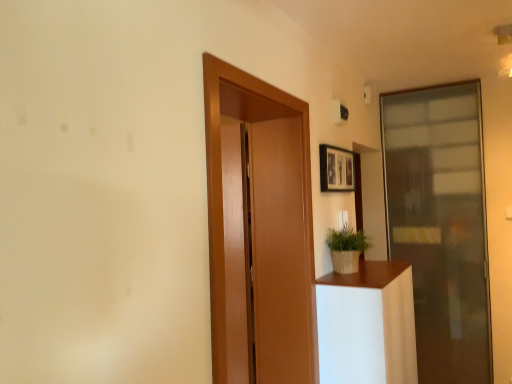
Question: From the image's perspective, does green woven basket at right appear higher than white matte plant pot at right?

Choices:
 (A) no
 (B) yes

Answer: (B)

Question: Is green woven basket at right thinner than white matte plant pot at right?

Choices:
 (A) no
 (B) yes

Answer: (B)

Question: Does green woven basket at right appear on the right side of white matte plant pot at right?

Choices:
 (A) no
 (B) yes

Answer: (A)

Question: Is white matte plant pot at right inside green woven basket at right?

Choices:
 (A) yes
 (B) no

Answer: (B)

Question: Is green woven basket at right to the left of white matte plant pot at right from the viewer's perspective?

Choices:
 (A) no
 (B) yes

Answer: (B)

Question: From their relative heights in the image, would you say transparent glass door at right, which is the first door from back to front, is taller or shorter than white matte plant pot at right?

Choices:
 (A) short
 (B) tall

Answer: (B)

Question: Is point (455, 226) positioned closer to the camera than point (398, 307)?

Choices:
 (A) farther
 (B) closer

Answer: (A)

Question: From the image's perspective, is transparent glass door at right, marked as the 1th door in a right-to-left arrangement, located above or below white matte plant pot at right?

Choices:
 (A) below
 (B) above

Answer: (B)

Question: Would you say transparent glass door at right, the 2th door positioned from the left, is to the left or to the right of white matte plant pot at right in the picture?

Choices:
 (A) right
 (B) left

Answer: (A)

Question: From the image's perspective, relative to transparent glass door at right, the 2th door positioned from the left, is green woven basket at right above or below?

Choices:
 (A) above
 (B) below

Answer: (A)

Question: Looking at their shapes, would you say green woven basket at right is wider or thinner than transparent glass door at right, marked as the 1th door in a right-to-left arrangement?

Choices:
 (A) wide
 (B) thin

Answer: (A)

Question: Do you think green woven basket at right is within transparent glass door at right, which is the second door from front to back, or outside of it?

Choices:
 (A) inside
 (B) outside

Answer: (B)

Question: Is point (333, 261) closer or farther from the camera than point (444, 352)?

Choices:
 (A) farther
 (B) closer

Answer: (B)

Question: Considering the relative positions of transparent glass door at right, the 2th door positioned from the left, and wooden framed picture at upper right in the image provided, is transparent glass door at right, the 2th door positioned from the left, to the left or to the right of wooden framed picture at upper right?

Choices:
 (A) right
 (B) left

Answer: (A)

Question: Relative to wooden framed picture at upper right, is transparent glass door at right, the 2th door positioned from the left, in front or behind?

Choices:
 (A) behind
 (B) front

Answer: (A)